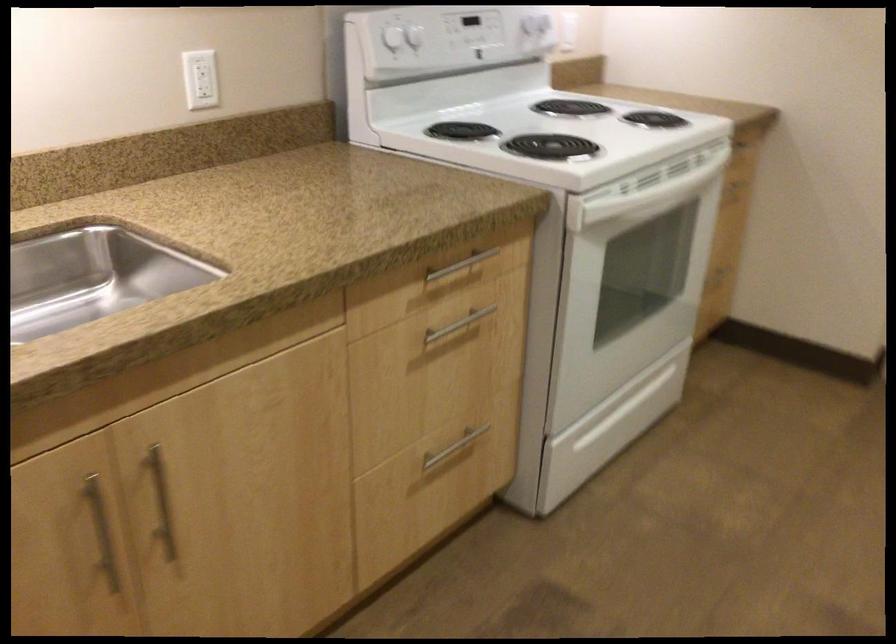
Identify the location of white light switch. This screenshot has height=644, width=896. (200, 79).